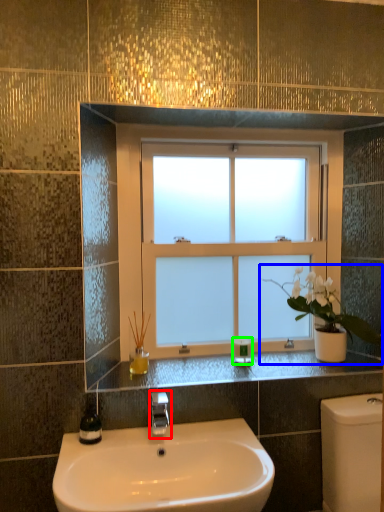
Question: Which object is positioned farthest from tap (highlighted by a red box)? Select from houseplant (highlighted by a blue box) and toiletry (highlighted by a green box).

Choices:
 (A) houseplant
 (B) toiletry

Answer: (A)